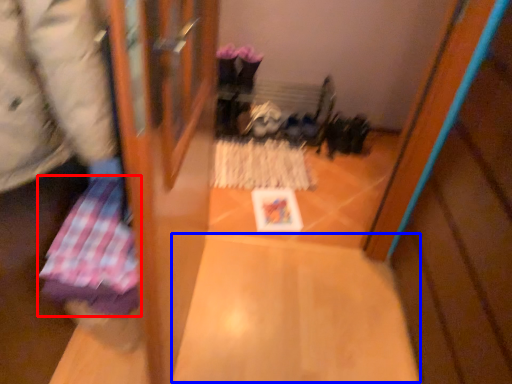
Question: Which object appears closest to the camera in this image, wrapping paper (highlighted by a red box) or wide (highlighted by a blue box)?

Choices:
 (A) wrapping paper
 (B) wide

Answer: (A)